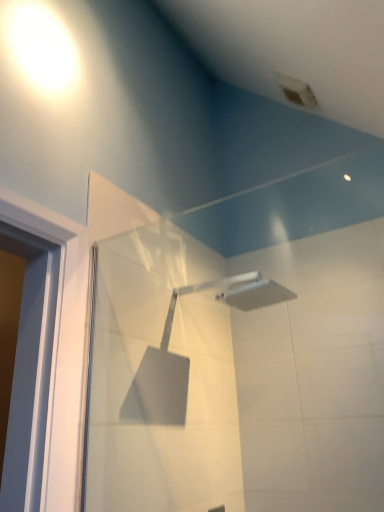
Measure the distance between point (253, 293) and camera.

A distance of 6.35 feet exists between point (253, 293) and camera.

Identify the location of silver metallic shower head at upper center. (242, 291).

This screenshot has height=512, width=384. What do you see at coordinates (242, 291) in the screenshot?
I see `silver metallic shower head at upper center` at bounding box center [242, 291].

Identify the location of silver metallic shower head at upper center. (242, 291).